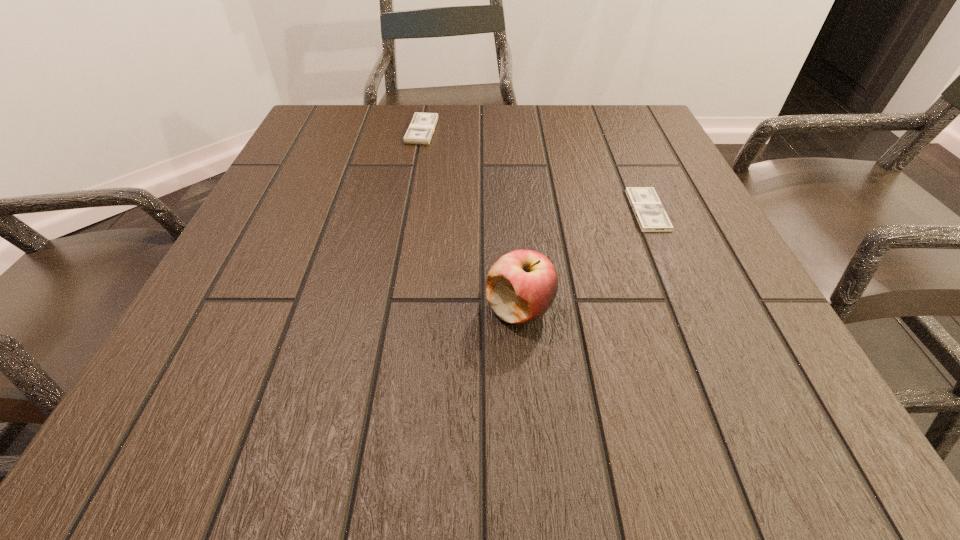
In order to click on vacant space that satisfies the following two spatial constraints: 1. on the front side of the shortest object; 2. on the left side of the taller dollar in this screenshot , I will do `click(407, 210)`.

Where is `vacant position in the image that satisfies the following two spatial constraints: 1. on the front side of the left dollar; 2. on the left side of the right dollar`? The image size is (960, 540). vacant position in the image that satisfies the following two spatial constraints: 1. on the front side of the left dollar; 2. on the left side of the right dollar is located at coordinates (407, 210).

This screenshot has height=540, width=960. What are the coordinates of `vacant position in the image that satisfies the following two spatial constraints: 1. on the front side of the apple; 2. on the right side of the farthest object` in the screenshot? It's located at (389, 309).